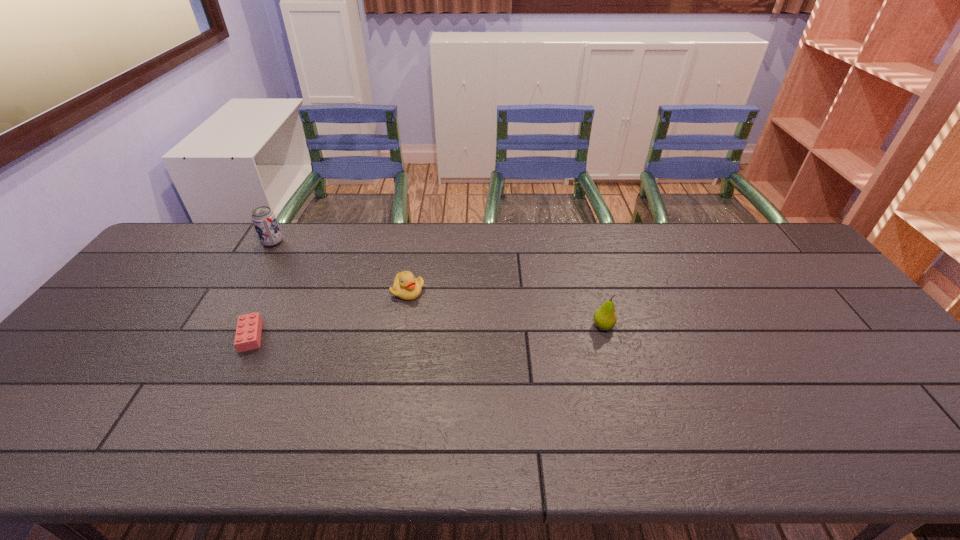
Find the location of `free space located 0.190m on the back of the shortest object`. free space located 0.190m on the back of the shortest object is located at coordinates (282, 275).

The image size is (960, 540). What are the coordinates of `object present at the far edge` in the screenshot? It's located at (263, 218).

Identify the location of vacant region at the far edge of the desktop. The height and width of the screenshot is (540, 960). (606, 254).

Image resolution: width=960 pixels, height=540 pixels. I want to click on free point at the near edge, so click(x=190, y=460).

In order to click on free space at the left edge in this screenshot , I will do (110, 325).

Locate an element on the screen. This screenshot has width=960, height=540. vacant region at the far right corner of the desktop is located at coordinates (761, 237).

You are a GUI agent. You are given a task and a screenshot of the screen. Output one action in this format:
    pyautogui.click(x=<x>, y=<y>)
    Task: Click on the unoccupied area between the rightmost object and the third nearest object
    The image size is (960, 540).
    Given the screenshot: What is the action you would take?
    pyautogui.click(x=506, y=308)

You are a GUI agent. You are given a task and a screenshot of the screen. Output one action in this format:
    pyautogui.click(x=<x>, y=<y>)
    Task: Click on the vacant area that lies between the pear and the Lego
    The image size is (960, 540).
    Given the screenshot: What is the action you would take?
    pyautogui.click(x=427, y=330)

Locate an element on the screen. free space between the beer can and the second object from left to right is located at coordinates (262, 289).

The height and width of the screenshot is (540, 960). I want to click on empty location between the duckling and the rightmost object, so click(x=506, y=308).